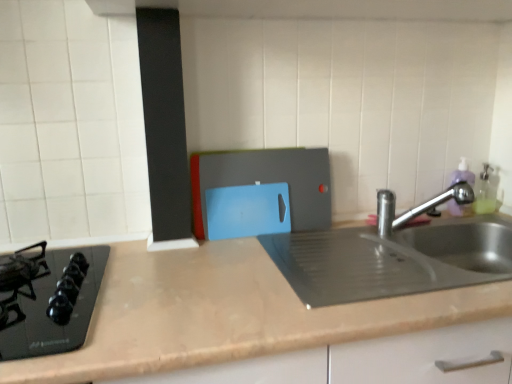
Question: Can you confirm if black glass gas stove at left is smaller than blue plastic cutting board at center?

Choices:
 (A) no
 (B) yes

Answer: (A)

Question: Can you confirm if black glass gas stove at left is shorter than blue plastic cutting board at center?

Choices:
 (A) no
 (B) yes

Answer: (B)

Question: Is blue plastic cutting board at center a part of black glass gas stove at left?

Choices:
 (A) no
 (B) yes

Answer: (A)

Question: From a real-world perspective, is black glass gas stove at left over blue plastic cutting board at center?

Choices:
 (A) yes
 (B) no

Answer: (B)

Question: Is blue plastic cutting board at center at the back of black glass gas stove at left?

Choices:
 (A) yes
 (B) no

Answer: (B)

Question: Is black glass gas stove at left positioned beyond the bounds of blue plastic cutting board at center?

Choices:
 (A) no
 (B) yes

Answer: (B)

Question: Is black glass gas stove at left closer to camera compared to satin nickel faucet at right?

Choices:
 (A) yes
 (B) no

Answer: (A)

Question: Is black glass gas stove at left not within satin nickel faucet at right?

Choices:
 (A) no
 (B) yes

Answer: (B)

Question: Is black glass gas stove at left aimed at satin nickel faucet at right?

Choices:
 (A) no
 (B) yes

Answer: (A)

Question: Is black glass gas stove at left facing away from satin nickel faucet at right?

Choices:
 (A) no
 (B) yes

Answer: (A)

Question: Is black glass gas stove at left smaller than satin nickel faucet at right?

Choices:
 (A) yes
 (B) no

Answer: (B)

Question: Considering the relative sizes of black glass gas stove at left and satin nickel faucet at right in the image provided, is black glass gas stove at left thinner than satin nickel faucet at right?

Choices:
 (A) yes
 (B) no

Answer: (B)

Question: From the image's perspective, is blue plastic cutting board at center beneath black glass gas stove at left?

Choices:
 (A) yes
 (B) no

Answer: (B)